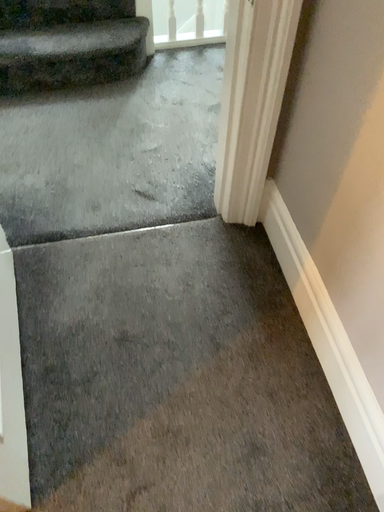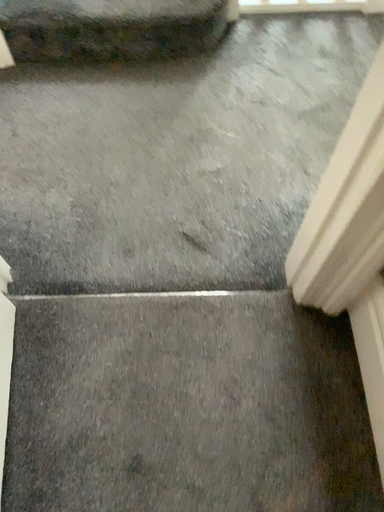
Question: Which way did the camera rotate in the video?

Choices:
 (A) rotated downward
 (B) rotated upward

Answer: (A)